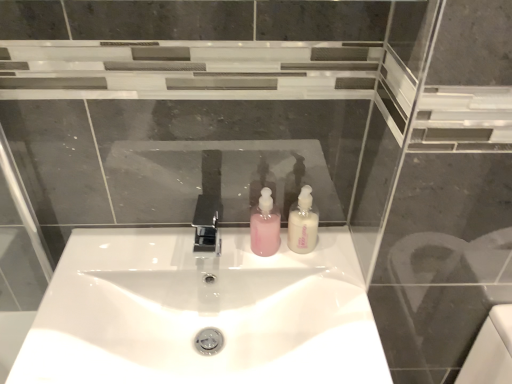
In order to click on free region on the left part of polished chrome tap at center in this screenshot , I will do `click(131, 261)`.